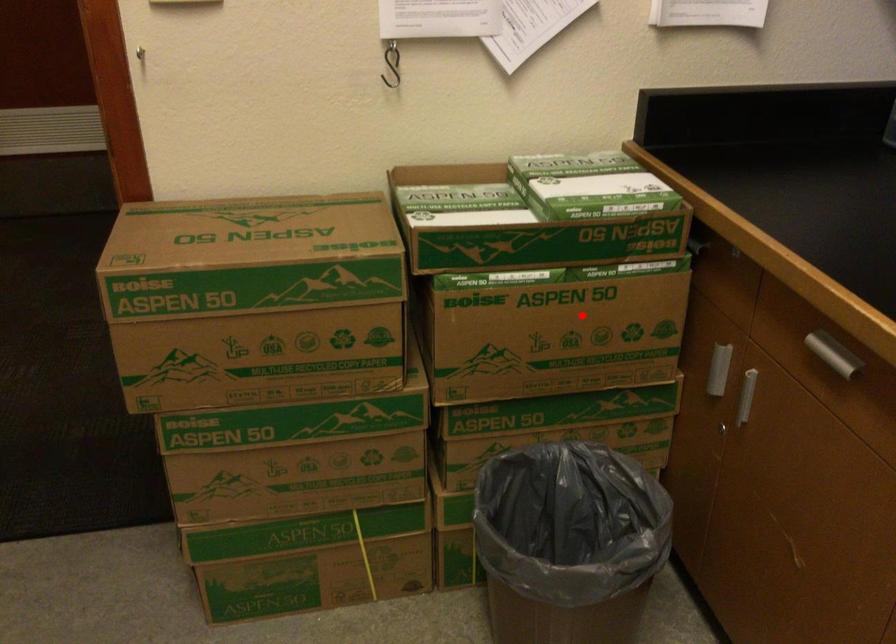
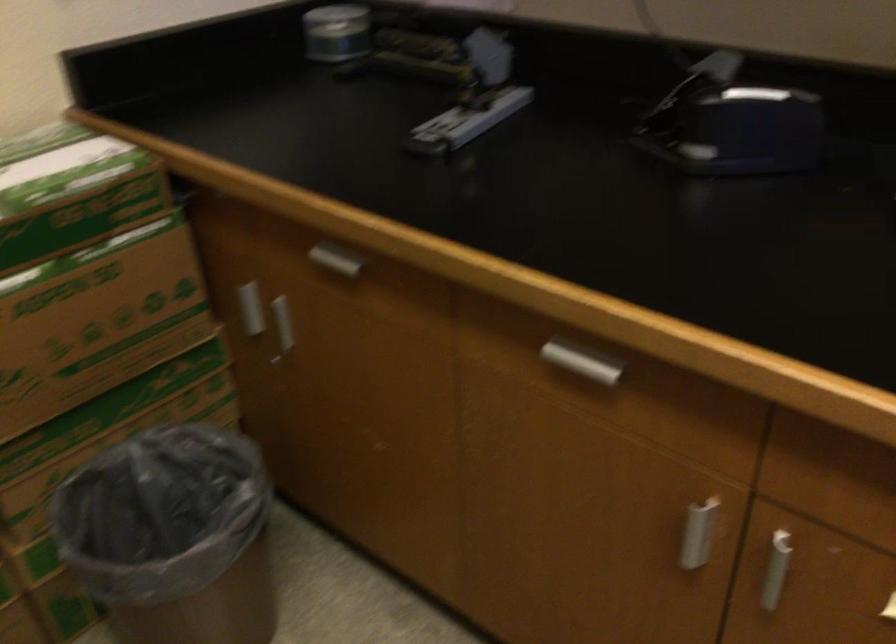
The point at the highlighted location is marked in the first image. Where is the corresponding point in the second image?

(99, 301)